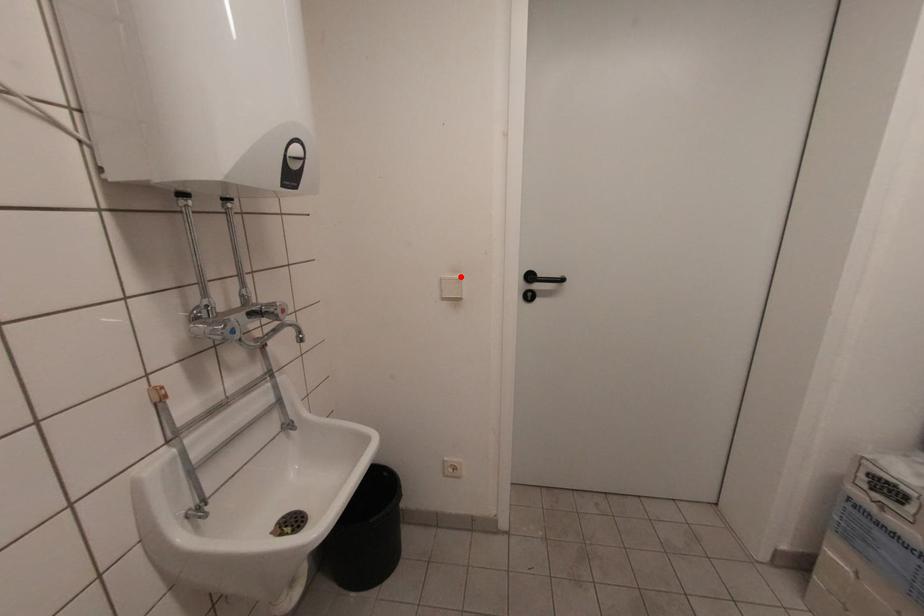
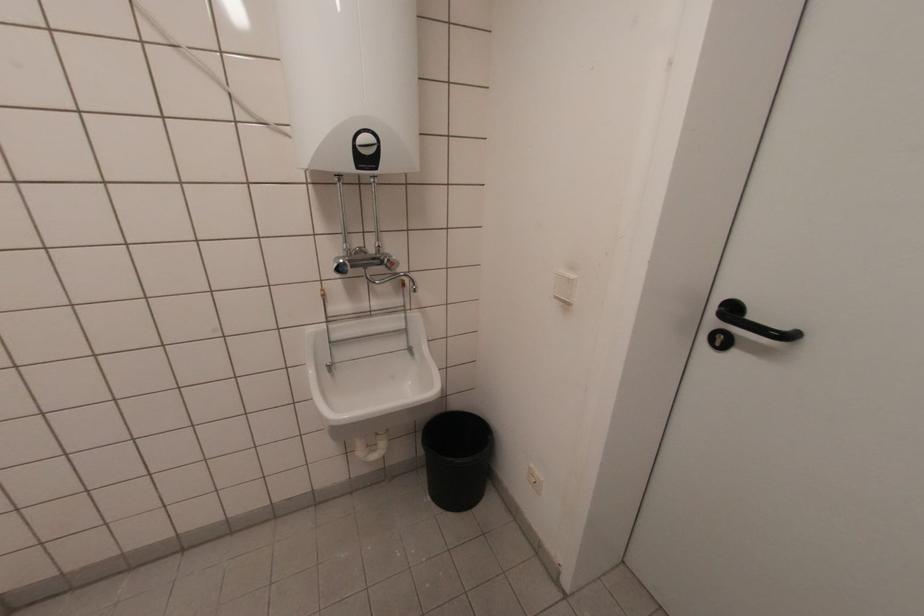
In the second image, find the point that corresponds to the highlighted location in the first image.

(573, 277)